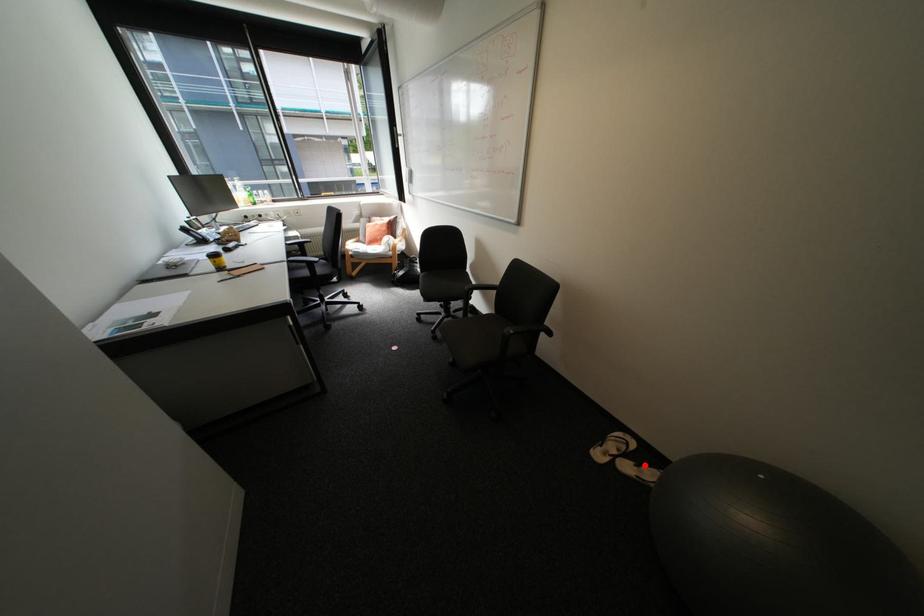
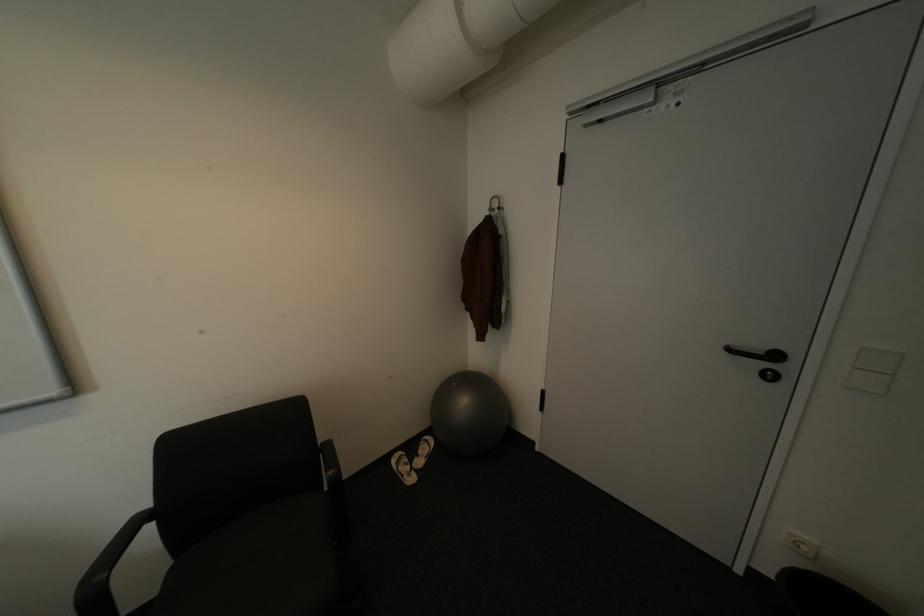
Question: I am providing you with two images of the same scene from different viewpoints. Given a red point in image1, look at the same physical point in image2. Is it:

Choices:
 (A) Closer to the viewpoint
 (B) Farther from the viewpoint

Answer: (B)